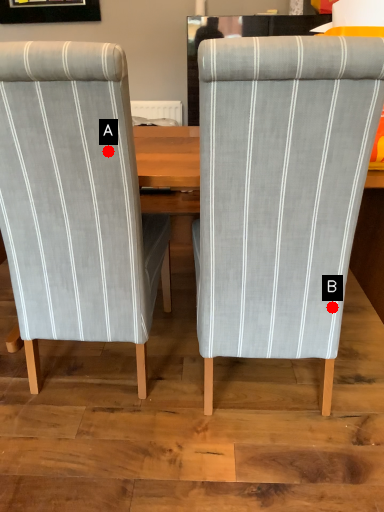
Question: Two points are circled on the image, labeled by A and B beside each circle. Which point is farther from the camera taking this photo?

Choices:
 (A) A is further
 (B) B is further

Answer: (B)